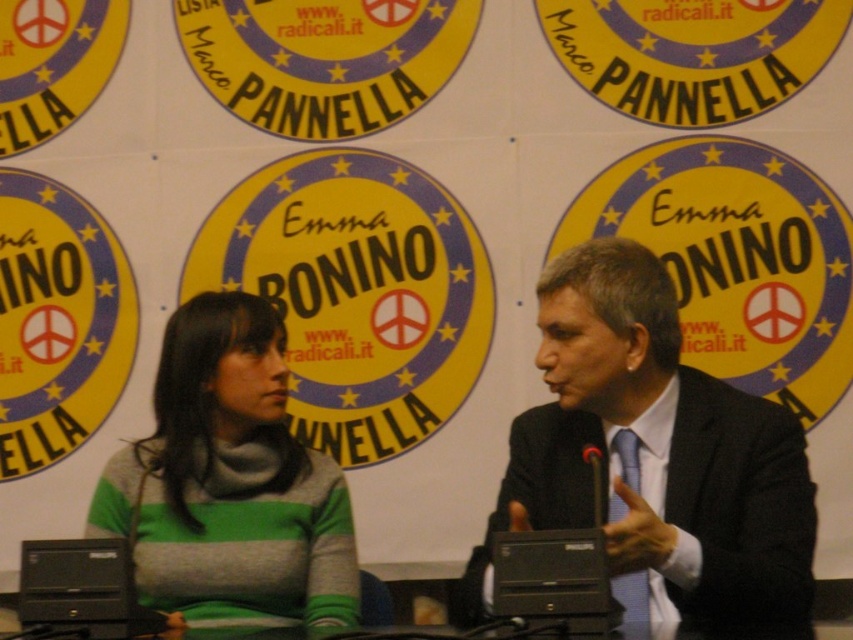
Question: Is dark suit at center to the right of green knitted sweater at center from the viewer's perspective?

Choices:
 (A) yes
 (B) no

Answer: (A)

Question: Is dark suit at center thinner than green knitted sweater at center?

Choices:
 (A) no
 (B) yes

Answer: (A)

Question: Which object appears closest to the camera in this image?

Choices:
 (A) green knitted sweater at center
 (B) dark suit at center

Answer: (B)

Question: Does dark suit at center appear on the left side of green knitted sweater at center?

Choices:
 (A) no
 (B) yes

Answer: (A)

Question: Which point is farther to the camera?

Choices:
 (A) (177, 544)
 (B) (624, 419)

Answer: (A)